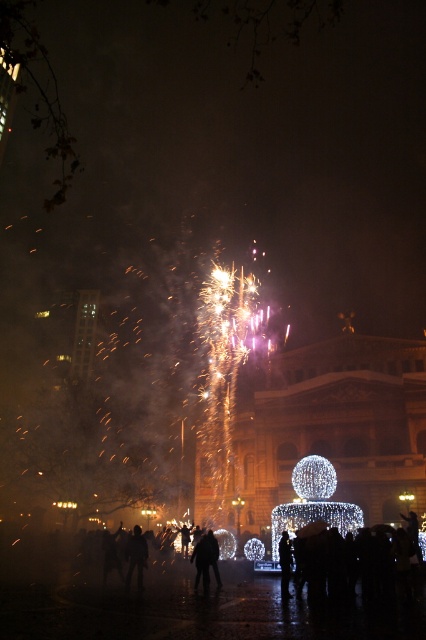
Identify the location of black matte person at center. The image size is (426, 640). (388, 557).

Is black matte person at center above dark clothing figure at center?

Yes.

This screenshot has height=640, width=426. What do you see at coordinates (388, 557) in the screenshot? I see `black matte person at center` at bounding box center [388, 557].

Identify the location of black matte person at center. The height and width of the screenshot is (640, 426). (388, 557).